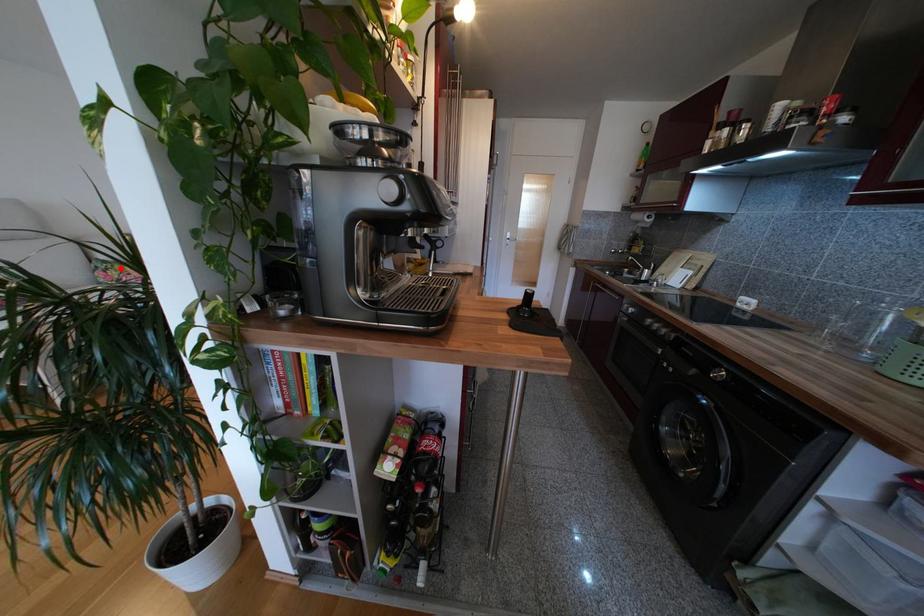
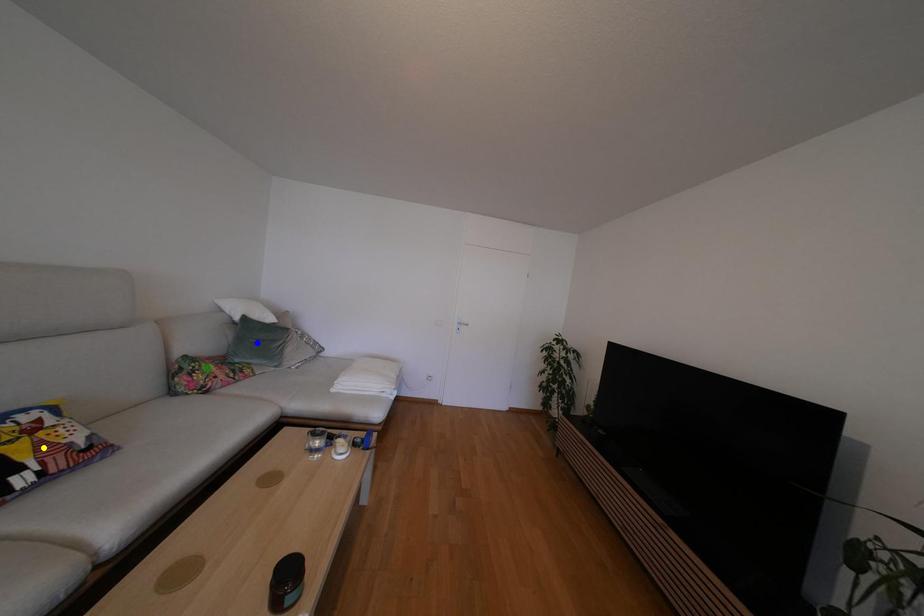
Question: I am providing you with two images of the same scene from different viewpoints. A red point is marked on the first image. You are given multiple points on the second image. Which mark in image 2 goes with the point in image 1?

Choices:
 (A) green point
 (B) blue point
 (C) yellow point

Answer: (A)